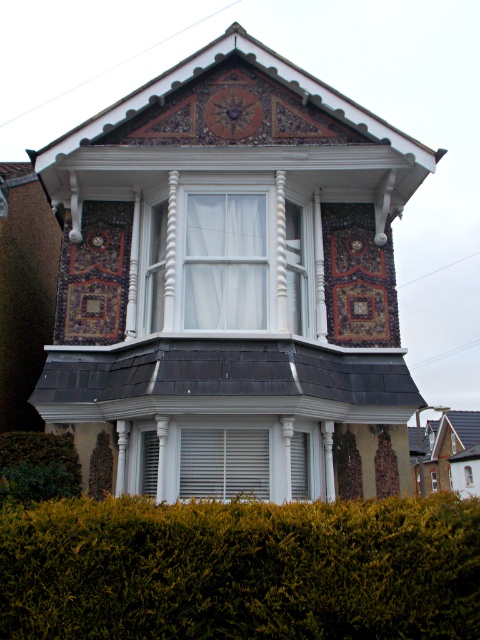
You are an architect designing a new addition to the Victorian house. You need to place a new decorative element between the white wood bay window at center and the white matte window at center. Given that the minimum required space for the element is 15 feet, will there be enough space?

The distance between the white wood bay window at center and the white matte window at center is 17.13 feet, which is more than the required 15 feet. Therefore, there is sufficient space to place the decorative element.

You are standing in front of the Victorian house and notice two points marked on the facade. The first point is at coordinates point (238, 312) and the second is at point (266, 499). Which point is closer to you?

Point (238, 312) is further to the camera than point (266, 499), so the second point is closer to you.